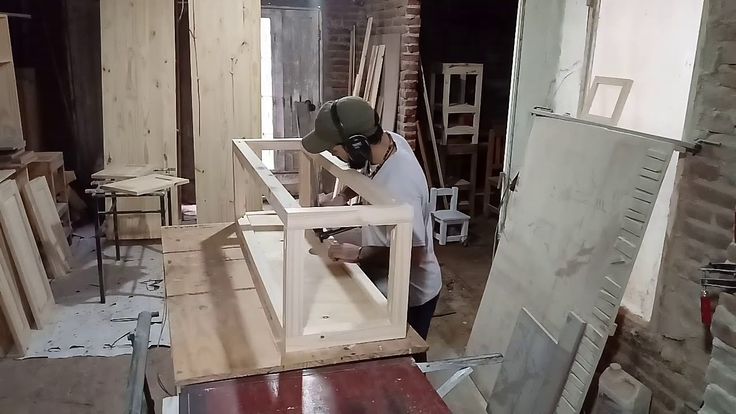
At what (x,y) coordinates should I click in order to perform the action: click on ladder. Please return your answer as a coordinate pair (x, y). The height and width of the screenshot is (414, 736). Looking at the image, I should click on (473, 69).